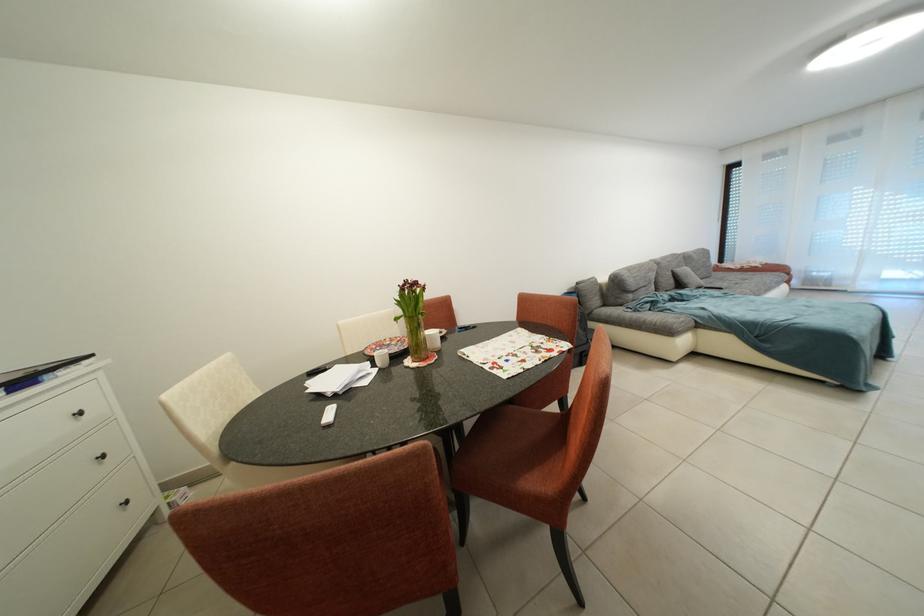
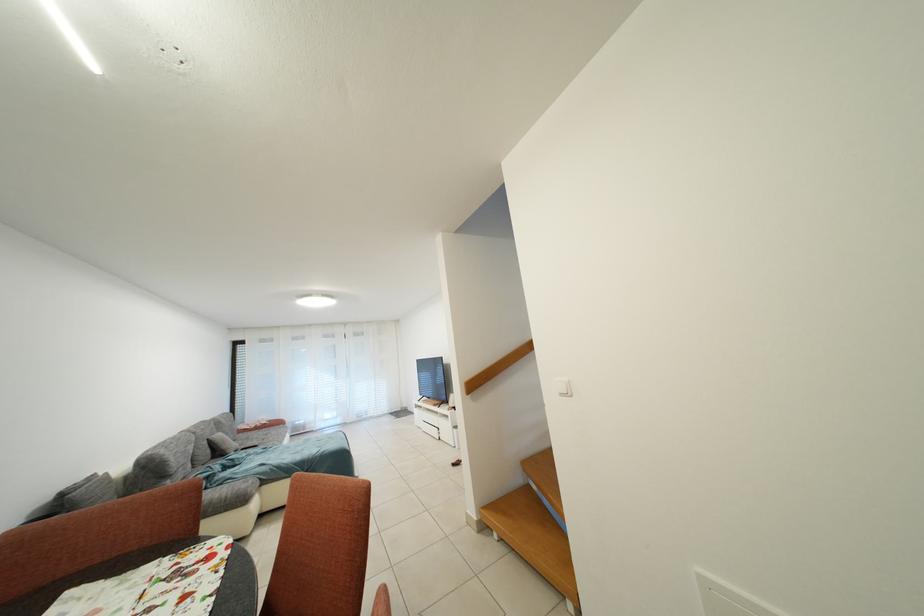
Locate, in the second image, the point that corresponds to pixel 688 290 in the first image.

(226, 456)